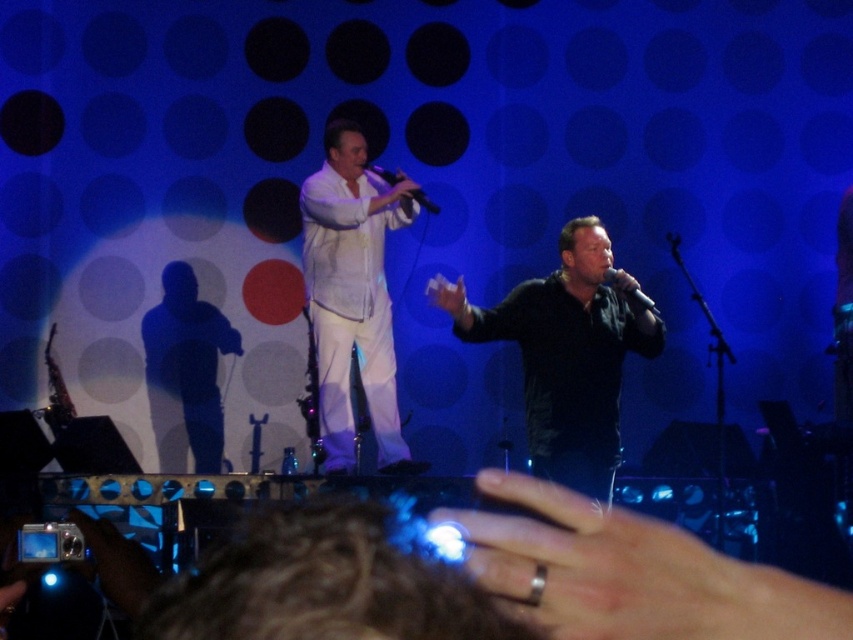
Does black matte shirt at center have a larger size compared to white sheer shirt at center?

Correct, black matte shirt at center is larger in size than white sheer shirt at center.

Identify the location of black matte shirt at center. Image resolution: width=853 pixels, height=640 pixels. point(566,353).

Find the location of `black matte shirt at center`. black matte shirt at center is located at coordinates (566, 353).

Is black matte shirt at center above black matte shadow at left?

Correct, black matte shirt at center is located above black matte shadow at left.

Which is behind, point (527, 385) or point (157, 438)?

Positioned behind is point (157, 438).

Find the location of a particular element. black matte shirt at center is located at coordinates coord(566,353).

Does white sheer shirt at center appear under black matte shadow at left?

No.

From the picture: Who is lower down, white sheer shirt at center or black matte shadow at left?

black matte shadow at left

Find the location of `white sheer shirt at center`. white sheer shirt at center is located at coordinates (352, 294).

Locate an element on the screen. The image size is (853, 640). white sheer shirt at center is located at coordinates (352, 294).